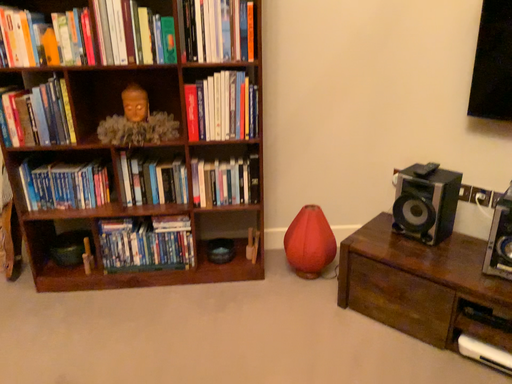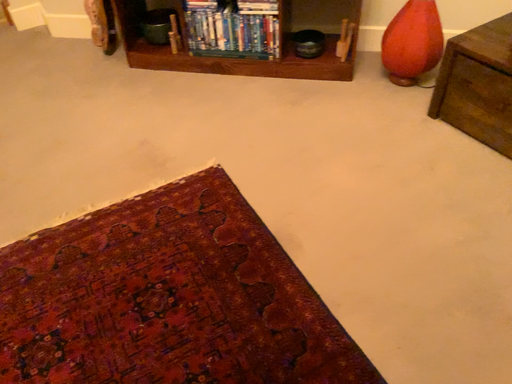
Question: Which way did the camera rotate in the video?

Choices:
 (A) rotated right
 (B) rotated left

Answer: (B)